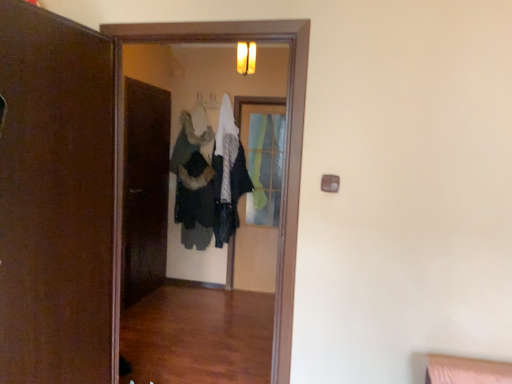
This screenshot has height=384, width=512. What do you see at coordinates (287, 139) in the screenshot? I see `wooden screen door at center, the 2th screen door viewed from the back` at bounding box center [287, 139].

What do you see at coordinates (55, 199) in the screenshot? The width and height of the screenshot is (512, 384). I see `brown matte door at left` at bounding box center [55, 199].

What do you see at coordinates (257, 196) in the screenshot?
I see `clear glass screen door at center, which appears as the second screen door when viewed from the front` at bounding box center [257, 196].

What is the approximate width of clear glass screen door at center, positioned as the 1th screen door in back-to-front order?

clear glass screen door at center, positioned as the 1th screen door in back-to-front order, is 2.53 inches wide.

At what (x,y) coordinates should I click in order to perform the action: click on wooden screen door at center, the first screen door viewed from the front. Please return your answer as a coordinate pair (x, y). The image size is (512, 384). Looking at the image, I should click on (287, 139).

Considering the relative sizes of wooden screen door at center, the first screen door viewed from the front, and clear glass screen door at center, which appears as the second screen door when viewed from the front, in the image provided, is wooden screen door at center, the first screen door viewed from the front, smaller than clear glass screen door at center, which appears as the second screen door when viewed from the front,?

No.

Is wooden screen door at center, the 2th screen door viewed from the back, facing away from clear glass screen door at center, positioned as the 1th screen door in back-to-front order?

Yes, wooden screen door at center, the 2th screen door viewed from the back, is facing away from clear glass screen door at center, positioned as the 1th screen door in back-to-front order.

From the image's perspective, which object appears higher, wooden screen door at center, the 2th screen door viewed from the back, or clear glass screen door at center, positioned as the 1th screen door in back-to-front order?

clear glass screen door at center, positioned as the 1th screen door in back-to-front order, from the image's perspective.

Is wooden screen door at center, the first screen door viewed from the front, not close to clear glass screen door at center, positioned as the 1th screen door in back-to-front order?

Yes, wooden screen door at center, the first screen door viewed from the front, and clear glass screen door at center, positioned as the 1th screen door in back-to-front order, are quite far apart.

Is clear glass screen door at center, which appears as the second screen door when viewed from the front, taller than brown matte door at left?

Indeed, clear glass screen door at center, which appears as the second screen door when viewed from the front, has a greater height compared to brown matte door at left.

Does clear glass screen door at center, which appears as the second screen door when viewed from the front, contain brown matte door at left?

That's incorrect, brown matte door at left is not inside clear glass screen door at center, which appears as the second screen door when viewed from the front.

Is clear glass screen door at center, positioned as the 1th screen door in back-to-front order, facing towards brown matte door at left?

Yes, clear glass screen door at center, positioned as the 1th screen door in back-to-front order, is facing brown matte door at left.

Is clear glass screen door at center, positioned as the 1th screen door in back-to-front order, wider than brown matte door at left?

No.

What are the coordinates of `screen door that appears in front of the clear glass screen door at center, positioned as the 1th screen door in back-to-front order` in the screenshot? It's located at pyautogui.click(x=287, y=139).

From the picture: Is clear glass screen door at center, which appears as the second screen door when viewed from the front, positioned far away from wooden screen door at center, the 2th screen door viewed from the back?

That's right, there is a large distance between clear glass screen door at center, which appears as the second screen door when viewed from the front, and wooden screen door at center, the 2th screen door viewed from the back.

Is the position of clear glass screen door at center, positioned as the 1th screen door in back-to-front order, more distant than that of wooden screen door at center, the first screen door viewed from the front?

Yes, it is behind wooden screen door at center, the first screen door viewed from the front.

From the image's perspective, which is below, clear glass screen door at center, positioned as the 1th screen door in back-to-front order, or wooden screen door at center, the first screen door viewed from the front?

From the image's view, wooden screen door at center, the first screen door viewed from the front, is below.

From the image's perspective, starting from the brown matte door at left, which screen door is the 2nd one above? Please provide its 2D coordinates.

[(257, 196)]

Is point (95, 286) closer or farther from the camera than point (257, 108)?

Clearly, point (95, 286) is closer to the camera than point (257, 108).

Which of these two, brown matte door at left or clear glass screen door at center, positioned as the 1th screen door in back-to-front order, stands taller?

clear glass screen door at center, positioned as the 1th screen door in back-to-front order.

Which is in front, wooden screen door at center, the 2th screen door viewed from the back, or dark gray fabric coat at center?

wooden screen door at center, the 2th screen door viewed from the back, is more forward.

How much distance is there between wooden screen door at center, the 2th screen door viewed from the back, and dark gray fabric coat at center?

They are 2.31 meters apart.

Identify the location of screen door on the left of the dark gray fabric coat at center. (287, 139).

Is wooden screen door at center, the 2th screen door viewed from the back, to the right of dark gray fabric coat at center from the viewer's perspective?

No.

Does dark gray fabric coat at center turn towards wooden screen door at center, the first screen door viewed from the front?

Yes, dark gray fabric coat at center is turned towards wooden screen door at center, the first screen door viewed from the front.

Is dark gray fabric coat at center far away from wooden screen door at center, the 2th screen door viewed from the back?

Absolutely, dark gray fabric coat at center is distant from wooden screen door at center, the 2th screen door viewed from the back.

From a real-world perspective, is dark gray fabric coat at center positioned under wooden screen door at center, the 2th screen door viewed from the back, based on gravity?

No, from a real-world perspective, dark gray fabric coat at center is not under wooden screen door at center, the 2th screen door viewed from the back.

Considering the sizes of objects brown matte door at left and dark gray fabric coat at center in the image provided, who is shorter, brown matte door at left or dark gray fabric coat at center?

dark gray fabric coat at center is shorter.

Based on the photo, from a real-world perspective, who is located higher, brown matte door at left or dark gray fabric coat at center?

In real-world perspective, dark gray fabric coat at center is above.

You are a GUI agent. You are given a task and a screenshot of the screen. Output one action in this format:
    pyautogui.click(x=<x>, y=<y>)
    Task: Click on the door on the left side of dark gray fabric coat at center
    
    Given the screenshot: What is the action you would take?
    pyautogui.click(x=55, y=199)

Where is `screen door below the wooden screen door at center, the first screen door viewed from the front (from a real-world perspective)`? The image size is (512, 384). screen door below the wooden screen door at center, the first screen door viewed from the front (from a real-world perspective) is located at coordinates (257, 196).

Find the location of `door located above the clear glass screen door at center, which appears as the second screen door when viewed from the front (from a real-world perspective)`. door located above the clear glass screen door at center, which appears as the second screen door when viewed from the front (from a real-world perspective) is located at coordinates (55, 199).

Estimate the real-world distances between objects in this image. Which object is closer to dark gray fabric coat at center, clear glass screen door at center, positioned as the 1th screen door in back-to-front order, or wooden screen door at center, the 2th screen door viewed from the back?

clear glass screen door at center, positioned as the 1th screen door in back-to-front order, lies closer to dark gray fabric coat at center than the other object.

Consider the image. Based on their spatial positions, is wooden screen door at center, the first screen door viewed from the front, or dark gray fabric coat at center closer to clear glass screen door at center, which appears as the second screen door when viewed from the front?

dark gray fabric coat at center is closer to clear glass screen door at center, which appears as the second screen door when viewed from the front.

Based on their spatial positions, is dark gray fabric coat at center or brown matte door at left further from clear glass screen door at center, which appears as the second screen door when viewed from the front?

brown matte door at left lies further to clear glass screen door at center, which appears as the second screen door when viewed from the front, than the other object.

Looking at the image, which one is located further to brown matte door at left, wooden screen door at center, the 2th screen door viewed from the back, or dark gray fabric coat at center?

dark gray fabric coat at center.

Which object lies nearer to the anchor point brown matte door at left, clear glass screen door at center, positioned as the 1th screen door in back-to-front order, or wooden screen door at center, the first screen door viewed from the front?

wooden screen door at center, the first screen door viewed from the front, is positioned closer to the anchor brown matte door at left.

Looking at this image, considering their positions, is dark gray fabric coat at center positioned further to wooden screen door at center, the 2th screen door viewed from the back, than clear glass screen door at center, positioned as the 1th screen door in back-to-front order?

Based on the image, clear glass screen door at center, positioned as the 1th screen door in back-to-front order, appears to be further to wooden screen door at center, the 2th screen door viewed from the back.

From the picture: Which object lies further to the anchor point clear glass screen door at center, which appears as the second screen door when viewed from the front, brown matte door at left or wooden screen door at center, the 2th screen door viewed from the back?

The object further to clear glass screen door at center, which appears as the second screen door when viewed from the front, is brown matte door at left.

When comparing their distances from clear glass screen door at center, which appears as the second screen door when viewed from the front, does dark gray fabric coat at center or wooden screen door at center, the first screen door viewed from the front, seem closer?

dark gray fabric coat at center lies closer to clear glass screen door at center, which appears as the second screen door when viewed from the front, than the other object.

Where is `screen door between brown matte door at left and clear glass screen door at center, which appears as the second screen door when viewed from the front, from front to back`? This screenshot has height=384, width=512. screen door between brown matte door at left and clear glass screen door at center, which appears as the second screen door when viewed from the front, from front to back is located at coordinates (287, 139).

Image resolution: width=512 pixels, height=384 pixels. In order to click on screen door between brown matte door at left and dark gray fabric coat at center in the front-back direction in this screenshot , I will do `click(287, 139)`.

Image resolution: width=512 pixels, height=384 pixels. In order to click on clothing positioned between wooden screen door at center, the 2th screen door viewed from the back, and clear glass screen door at center, which appears as the second screen door when viewed from the front, from near to far in this screenshot , I will do click(208, 178).

Where is `clothing located between brown matte door at left and clear glass screen door at center, which appears as the second screen door when viewed from the front, in the depth direction`? The width and height of the screenshot is (512, 384). clothing located between brown matte door at left and clear glass screen door at center, which appears as the second screen door when viewed from the front, in the depth direction is located at coordinates (208, 178).